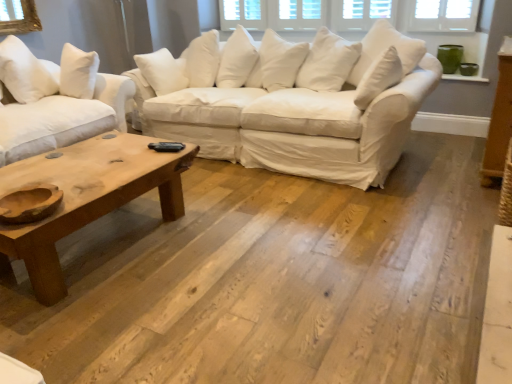
Question: Is natural wood studio couch at left, which appears as the first studio couch when viewed from the left, located outside white cotton pillow at upper left?

Choices:
 (A) no
 (B) yes

Answer: (B)

Question: Considering the relative positions of natural wood studio couch at left, positioned as the second studio couch in right-to-left order, and white cotton pillow at upper left in the image provided, is natural wood studio couch at left, positioned as the second studio couch in right-to-left order, to the left of white cotton pillow at upper left from the viewer's perspective?

Choices:
 (A) yes
 (B) no

Answer: (B)

Question: Does natural wood studio couch at left, which appears as the first studio couch when viewed from the left, have a larger size compared to white cotton pillow at upper left?

Choices:
 (A) yes
 (B) no

Answer: (A)

Question: Considering the relative sizes of natural wood studio couch at left, which appears as the first studio couch when viewed from the left, and white cotton pillow at upper left in the image provided, is natural wood studio couch at left, which appears as the first studio couch when viewed from the left, smaller than white cotton pillow at upper left?

Choices:
 (A) no
 (B) yes

Answer: (A)

Question: From the image's perspective, would you say natural wood studio couch at left, positioned as the second studio couch in right-to-left order, is shown under white cotton pillow at upper left?

Choices:
 (A) yes
 (B) no

Answer: (A)

Question: Is natural wood studio couch at left, positioned as the second studio couch in right-to-left order, not near white cotton pillow at upper left?

Choices:
 (A) no
 (B) yes

Answer: (A)

Question: Is natural wood coffee table at lower left positioned with its back to natural wood studio couch at left, which appears as the first studio couch when viewed from the left?

Choices:
 (A) no
 (B) yes

Answer: (B)

Question: Is natural wood coffee table at lower left to the right of natural wood studio couch at left, positioned as the second studio couch in right-to-left order, from the viewer's perspective?

Choices:
 (A) yes
 (B) no

Answer: (A)

Question: From the image's perspective, is natural wood coffee table at lower left located beneath natural wood studio couch at left, positioned as the second studio couch in right-to-left order?

Choices:
 (A) yes
 (B) no

Answer: (A)

Question: Is natural wood coffee table at lower left thinner than natural wood studio couch at left, positioned as the second studio couch in right-to-left order?

Choices:
 (A) yes
 (B) no

Answer: (A)

Question: From the image's perspective, would you say natural wood coffee table at lower left is positioned over natural wood studio couch at left, positioned as the second studio couch in right-to-left order?

Choices:
 (A) yes
 (B) no

Answer: (B)

Question: Does natural wood coffee table at lower left have a greater width compared to natural wood studio couch at left, positioned as the second studio couch in right-to-left order?

Choices:
 (A) no
 (B) yes

Answer: (A)

Question: Does white cotton pillow at upper left appear on the right side of white cotton couch at center, which is counted as the 2th studio couch, starting from the left?

Choices:
 (A) yes
 (B) no

Answer: (B)